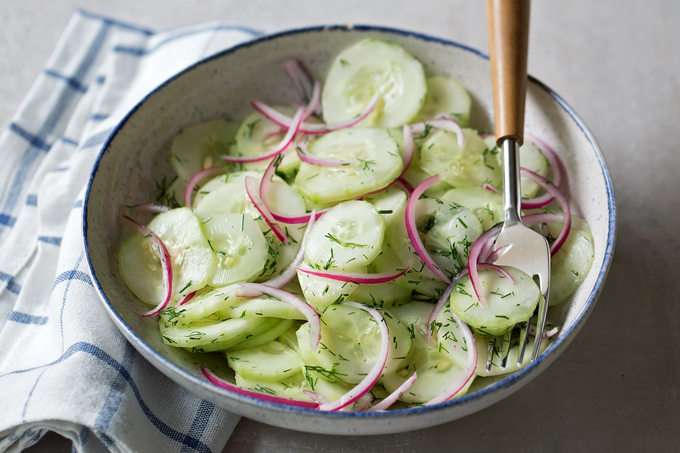
Locate an element on the screen. This screenshot has width=680, height=453. table is located at coordinates (656, 67).